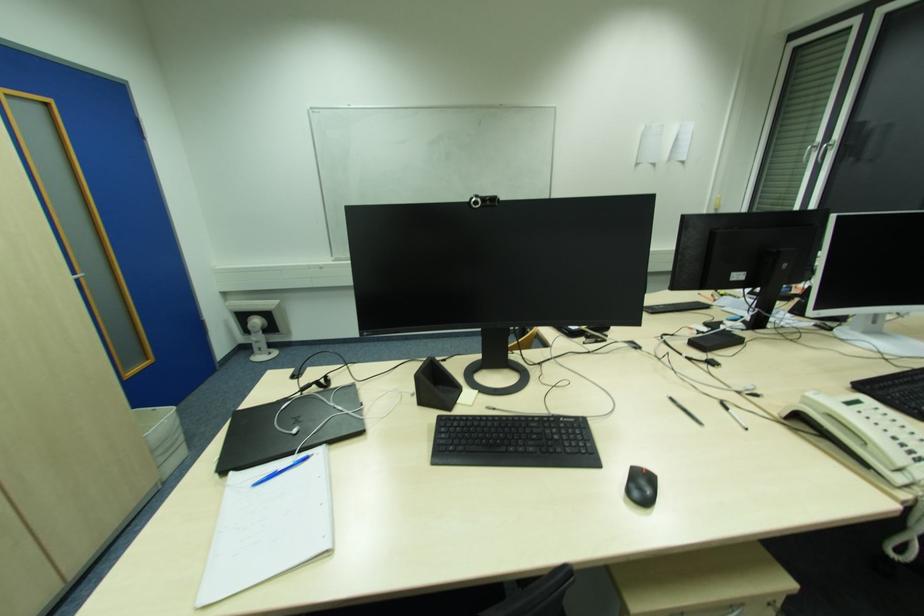
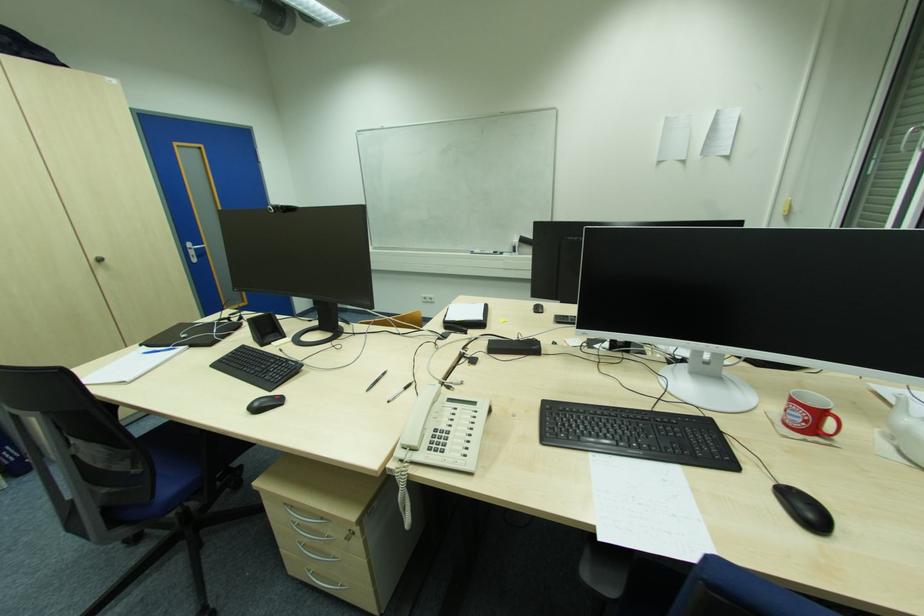
Question: What movement of the cameraman would produce the second image?

Choices:
 (A) Left
 (B) Right
 (C) Forward
 (D) Backward

Answer: (B)